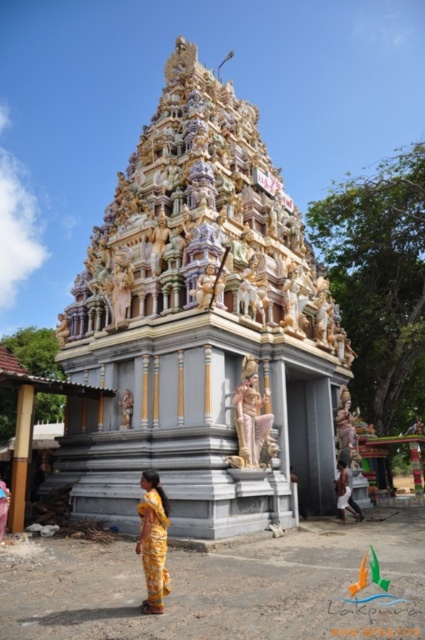
You are a photographer standing at the entrance of the temple. You want to capture a photo that shows both the polished stone temple at center and the yellow printed sari at lower center. Based on their sizes, which object should appear larger in the photo?

The polished stone temple at center is taller than the yellow printed sari at lower center, so it should appear larger in the photo.

You are standing in front of the temple and notice a point marked at coordinates point (153, 540). What object is located at that point?

The point (153, 540) corresponds to the yellow printed sari at lower center.